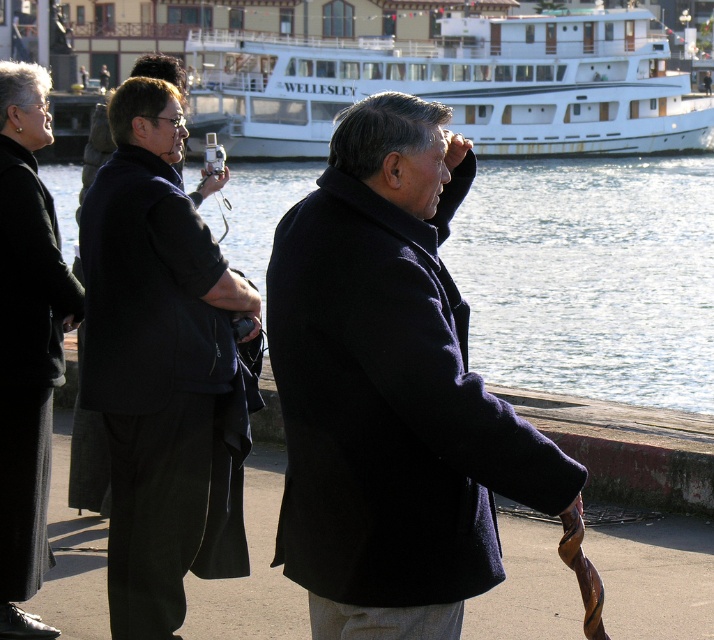
Question: Is matte black coat at center bigger than white glossy ship at upper center?

Choices:
 (A) yes
 (B) no

Answer: (B)

Question: Which object appears farthest from the camera in this image?

Choices:
 (A) white glossy ship at upper center
 (B) black matte coat at center

Answer: (A)

Question: Is black matte coat at center positioned behind white glossy ship at upper center?

Choices:
 (A) yes
 (B) no

Answer: (B)

Question: Which object appears farthest from the camera in this image?

Choices:
 (A) clear water at center
 (B) matte black coat at center
 (C) black matte coat at center
 (D) white glossy ship at upper center

Answer: (D)

Question: Which point is closer to the camera?

Choices:
 (A) (149, 308)
 (B) (508, 172)
 (C) (14, 580)

Answer: (C)

Question: Does clear water at center lie in front of black matte coat at center?

Choices:
 (A) yes
 (B) no

Answer: (A)